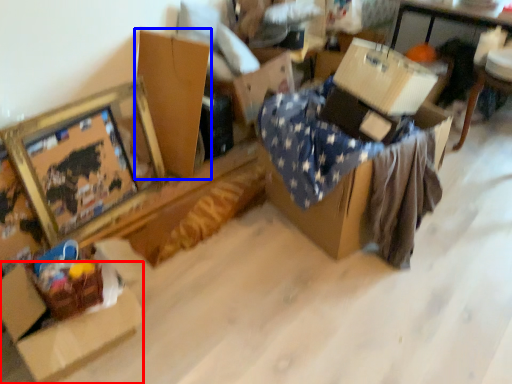
Question: Which object appears closest to the camera in this image, cardboard box (highlighted by a red box) or cardboard box (highlighted by a blue box)?

Choices:
 (A) cardboard box
 (B) cardboard box

Answer: (A)